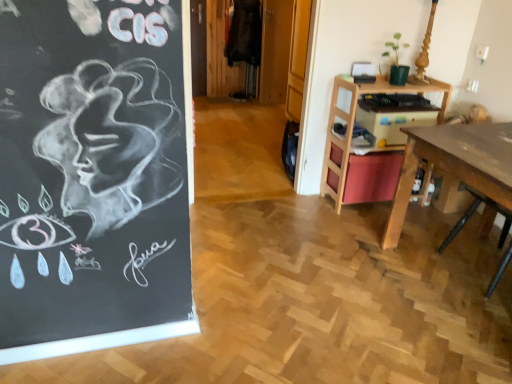
Question: Can you confirm if wooden desk at right is smaller than wooden desk at right?

Choices:
 (A) no
 (B) yes

Answer: (A)

Question: Does wooden desk at right have a larger size compared to wooden desk at right?

Choices:
 (A) yes
 (B) no

Answer: (A)

Question: From a real-world perspective, is wooden desk at right on top of wooden desk at right?

Choices:
 (A) no
 (B) yes

Answer: (A)

Question: Is the position of wooden desk at right less distant than that of wooden desk at right?

Choices:
 (A) yes
 (B) no

Answer: (A)

Question: From the image's perspective, is wooden desk at right on top of wooden desk at right?

Choices:
 (A) no
 (B) yes

Answer: (A)

Question: Can you confirm if wooden desk at right is positioned to the left of wooden desk at right?

Choices:
 (A) no
 (B) yes

Answer: (A)

Question: Is wooden desk at right oriented towards wooden desk at right?

Choices:
 (A) yes
 (B) no

Answer: (A)

Question: Considering the relative sizes of wooden desk at right and wooden desk at right in the image provided, is wooden desk at right shorter than wooden desk at right?

Choices:
 (A) no
 (B) yes

Answer: (A)

Question: Is wooden desk at right far from wooden desk at right?

Choices:
 (A) no
 (B) yes

Answer: (A)

Question: Is wooden desk at right not inside wooden desk at right?

Choices:
 (A) yes
 (B) no

Answer: (A)

Question: Is wooden desk at right bigger than wooden desk at right?

Choices:
 (A) no
 (B) yes

Answer: (A)

Question: Is wooden desk at right turned away from wooden desk at right?

Choices:
 (A) no
 (B) yes

Answer: (A)

Question: Would you say wooden desk at right is inside or outside wooden desk at right?

Choices:
 (A) outside
 (B) inside

Answer: (A)